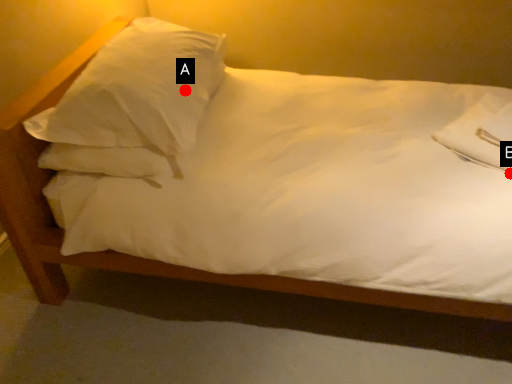
Question: Two points are circled on the image, labeled by A and B beside each circle. Which point is further to the camera?

Choices:
 (A) A is further
 (B) B is further

Answer: (A)